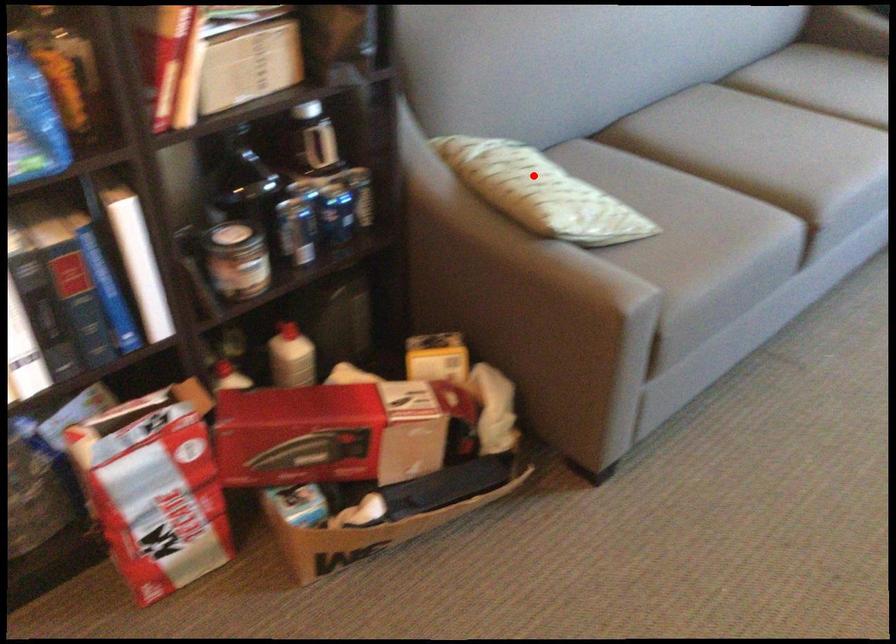
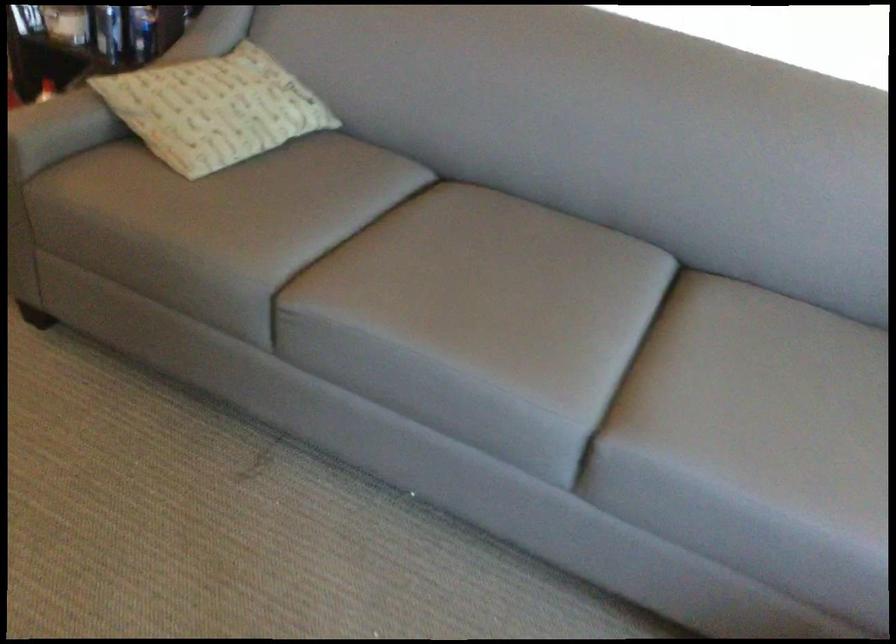
Find the pixel in the second image that matches the highlighted location in the first image.

(214, 93)